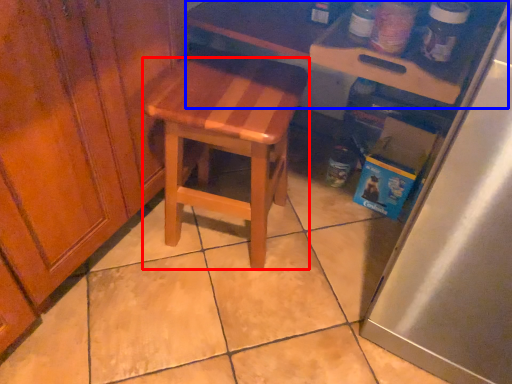
Question: Which object is closer to the camera taking this photo, stool (highlighted by a red box) or table (highlighted by a blue box)?

Choices:
 (A) stool
 (B) table

Answer: (B)